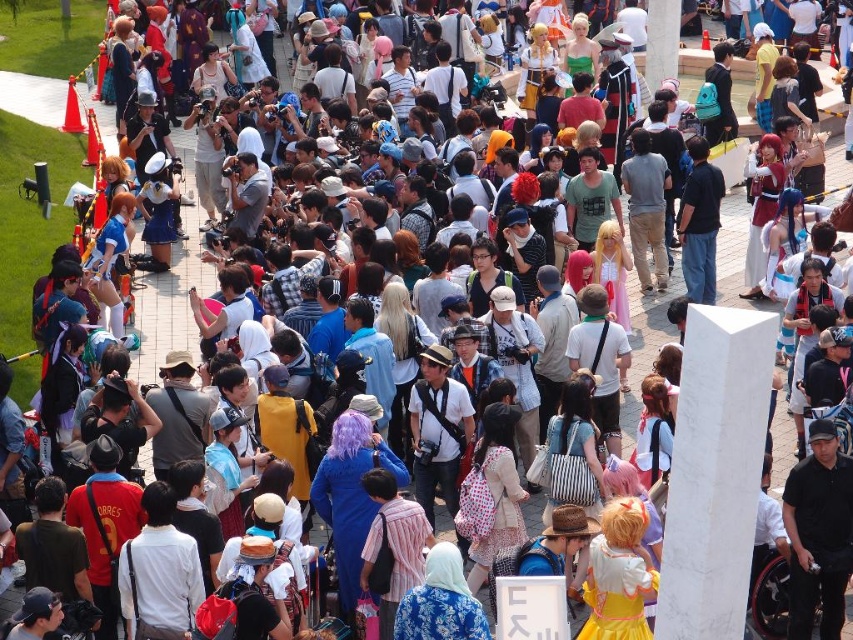
Question: Is the position of white marble pillar at center less distant than that of dark blue shirt at center?

Choices:
 (A) no
 (B) yes

Answer: (B)

Question: Does black cotton shirt at center appear on the left side of dark blue shirt at center?

Choices:
 (A) yes
 (B) no

Answer: (B)

Question: Which of the following is the farthest from the observer?

Choices:
 (A) (697, 244)
 (B) (686, 598)

Answer: (A)

Question: Among these points, which one is farthest from the camera?

Choices:
 (A) (825, 534)
 (B) (695, 221)

Answer: (B)

Question: Which object is positioned closest to the white marble pillar at center?

Choices:
 (A) dark blue shirt at center
 (B) black cotton shirt at center

Answer: (B)

Question: Is white marble pillar at center below dark blue shirt at center?

Choices:
 (A) no
 (B) yes

Answer: (B)